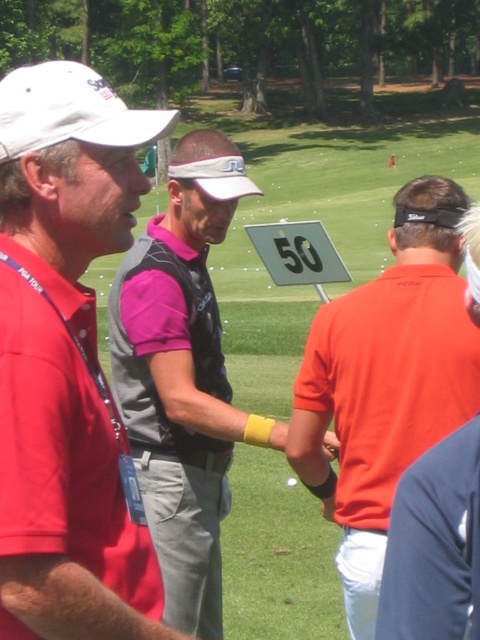
Measure the distance between pink fabric shirt at center and white matte baseball cap at upper left.

A distance of 1.59 meters exists between pink fabric shirt at center and white matte baseball cap at upper left.

Can you confirm if pink fabric shirt at center is taller than white matte baseball cap at upper left?

Yes.

Does point (188, 380) come farther from viewer compared to point (26, 76)?

Yes.

This screenshot has width=480, height=640. Identify the location of pink fabric shirt at center. (182, 378).

Is white matte cap at upper left shorter than orange matte shirt at center?

Indeed, white matte cap at upper left has a lesser height compared to orange matte shirt at center.

Is white matte cap at upper left to the right of orange matte shirt at center from the viewer's perspective?

No, white matte cap at upper left is not to the right of orange matte shirt at center.

Between point (167, 132) and point (338, 308), which one is positioned in front?

Positioned in front is point (167, 132).

Find the location of a particular element. white matte cap at upper left is located at coordinates (67, 362).

Which of these two, orange matte shirt at center or white matte baseball cap at upper left, stands shorter?

white matte baseball cap at upper left is shorter.

Between point (354, 348) and point (10, 86), which one is positioned in front?

Point (10, 86) is in front.

Does point (455, 284) come farther from viewer compared to point (24, 84)?

That is True.

Locate an element on the screen. The width and height of the screenshot is (480, 640). orange matte shirt at center is located at coordinates (385, 384).